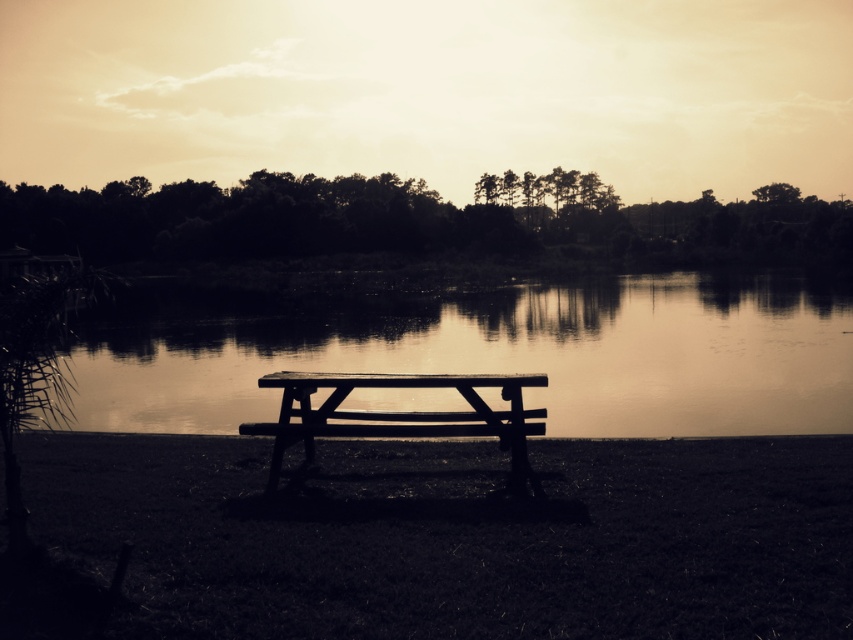
You are planning to throw a small stone into the water from the wooden bench at center. Considering the smooth water at bench left is 10.94 meters away, will the stone land in the water if you throw it straight ahead?

The smooth water at bench left is 10.94 meters from the wooden bench at center. If you throw the stone straight ahead towards the smooth water at bench left, it will land in the water since the distance is achievable with a typical throw.